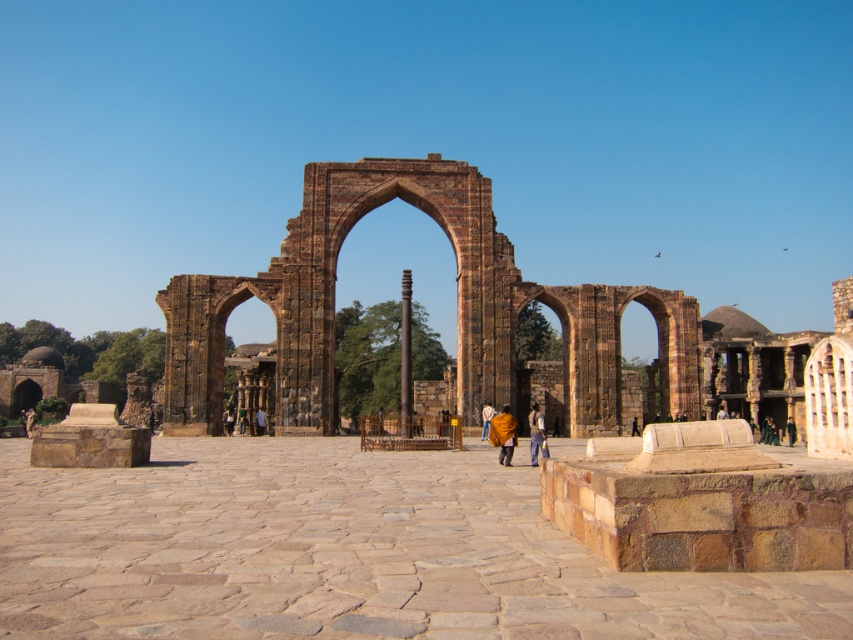
Can you confirm if brown stone arch at center is smaller than brown stone pillar at center?

Actually, brown stone arch at center might be larger than brown stone pillar at center.

This screenshot has height=640, width=853. Describe the element at coordinates (457, 308) in the screenshot. I see `brown stone arch at center` at that location.

Identify the location of brown stone arch at center. (457, 308).

Can you confirm if brown stone arch at center is taller than dark brown leather pants at center?

Yes.

Does brown stone arch at center have a larger size compared to dark brown leather pants at center?

Indeed, brown stone arch at center has a larger size compared to dark brown leather pants at center.

In order to click on brown stone arch at center in this screenshot , I will do `click(457, 308)`.

How far apart are brown stone pillar at center and orange fabric person at center?

brown stone pillar at center and orange fabric person at center are 13.51 meters apart.

Is point (405, 333) positioned before point (502, 428)?

No, (405, 333) is behind (502, 428).

Locate an element on the screen. Image resolution: width=853 pixels, height=640 pixels. brown stone pillar at center is located at coordinates (405, 355).